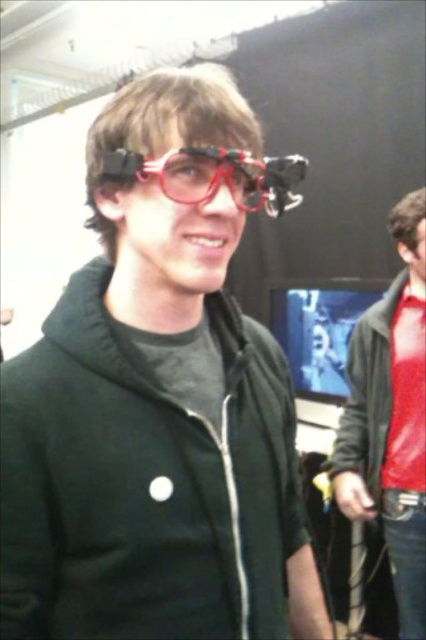
Question: Does matte black jacket at right appear under transparent plastic goggles at center?

Choices:
 (A) no
 (B) yes

Answer: (B)

Question: Which of the following is the farthest from the observer?

Choices:
 (A) transparent plastic goggles at center
 (B) matte black jacket at center
 (C) matte black jacket at right

Answer: (C)

Question: Which point is farther from the camera taking this photo?

Choices:
 (A) (209, 164)
 (B) (247, 556)
 (C) (393, 493)

Answer: (C)

Question: Can you confirm if matte black jacket at center is positioned to the left of matte black jacket at right?

Choices:
 (A) yes
 (B) no

Answer: (A)

Question: Which object appears farthest from the camera in this image?

Choices:
 (A) transparent plastic goggles at center
 (B) matte black jacket at center
 (C) matte black jacket at right

Answer: (C)

Question: Can you confirm if matte black jacket at center is smaller than matte black jacket at right?

Choices:
 (A) no
 (B) yes

Answer: (B)